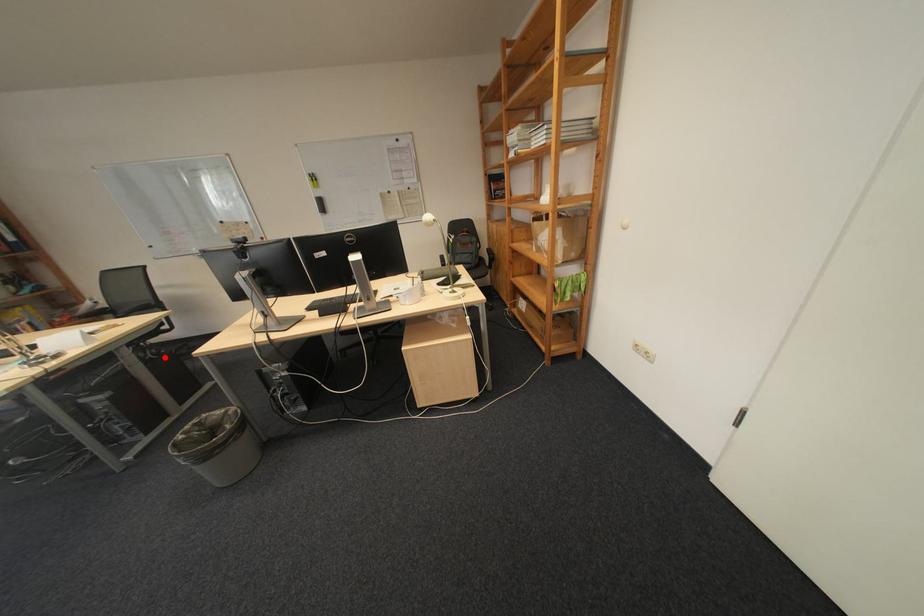
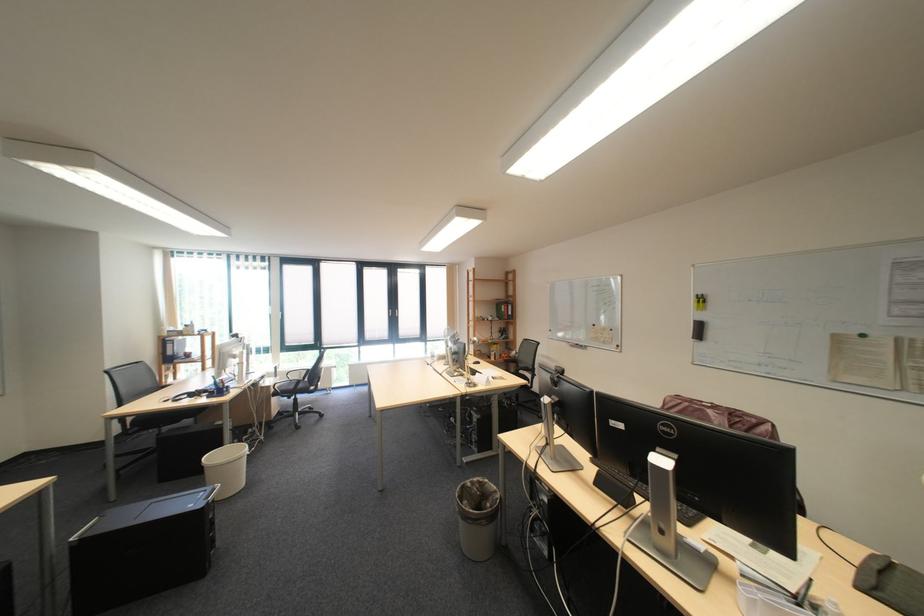
Where in the second image is the point corresponding to the highlighted location from the first image?

(519, 406)